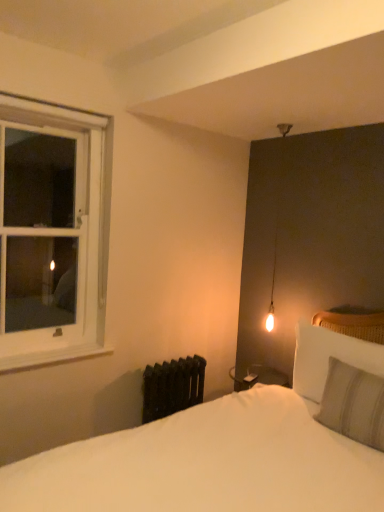
Question: From a real-world perspective, is black cast iron radiator at lower left beneath white painted wood at left?

Choices:
 (A) no
 (B) yes

Answer: (B)

Question: Is black cast iron radiator at lower left bigger than white painted wood at left?

Choices:
 (A) no
 (B) yes

Answer: (B)

Question: Would you consider black cast iron radiator at lower left to be distant from white painted wood at left?

Choices:
 (A) no
 (B) yes

Answer: (A)

Question: Is white painted wood at left completely or partially inside black cast iron radiator at lower left?

Choices:
 (A) no
 (B) yes

Answer: (A)

Question: Is black cast iron radiator at lower left smaller than white painted wood at left?

Choices:
 (A) no
 (B) yes

Answer: (A)

Question: From a real-world perspective, is light gray striped pillow at right, the first pillow viewed from the front, above or below white wooden window at left?

Choices:
 (A) below
 (B) above

Answer: (A)

Question: Looking at the image, does light gray striped pillow at right, the first pillow viewed from the front, seem bigger or smaller compared to white wooden window at left?

Choices:
 (A) big
 (B) small

Answer: (B)

Question: Relative to white wooden window at left, is light gray striped pillow at right, the first pillow viewed from the front, in front or behind?

Choices:
 (A) front
 (B) behind

Answer: (A)

Question: Is light gray striped pillow at right, which is the 2th pillow in back-to-front order, wider or thinner than white wooden window at left?

Choices:
 (A) wide
 (B) thin

Answer: (A)

Question: Visually, is white painted wood at left positioned to the left or to the right of white wooden window at left?

Choices:
 (A) left
 (B) right

Answer: (B)

Question: Based on their sizes in the image, would you say white painted wood at left is bigger or smaller than white wooden window at left?

Choices:
 (A) small
 (B) big

Answer: (A)

Question: Is white painted wood at left taller or shorter than white wooden window at left?

Choices:
 (A) tall
 (B) short

Answer: (B)

Question: Is white painted wood at left situated inside white wooden window at left or outside?

Choices:
 (A) inside
 (B) outside

Answer: (A)

Question: Looking at their shapes, would you say gray striped pillow at right, the first pillow when ordered from back to front, is wider or thinner than black cast iron radiator at lower left?

Choices:
 (A) thin
 (B) wide

Answer: (A)

Question: From the image's perspective, is gray striped pillow at right, the 2th pillow from the front, above or below black cast iron radiator at lower left?

Choices:
 (A) below
 (B) above

Answer: (B)